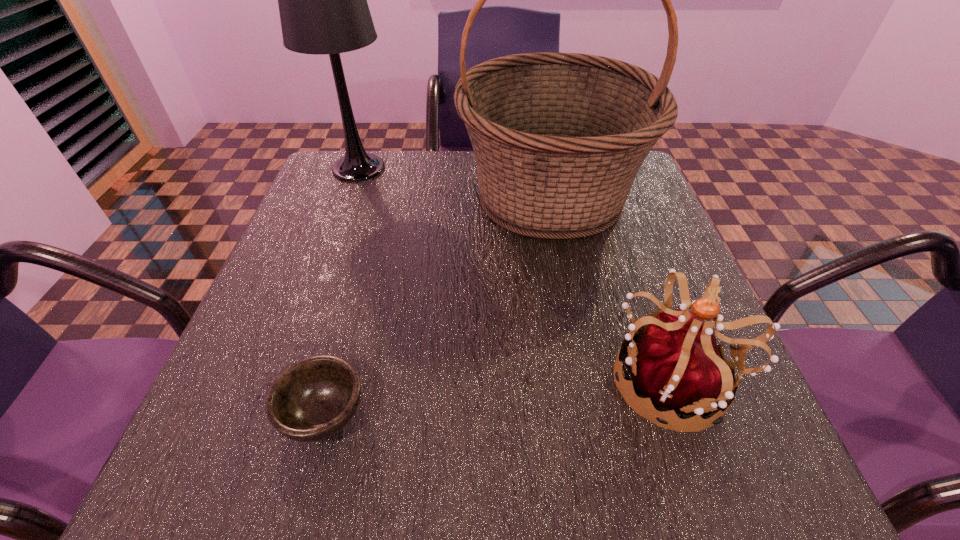
You are a GUI agent. You are given a task and a screenshot of the screen. Output one action in this format:
    pyautogui.click(x=<x>, y=<y>)
    Task: Click on the vacant point located between the table lamp and the second shortest object
    
    Given the screenshot: What is the action you would take?
    pyautogui.click(x=516, y=274)

The image size is (960, 540). Find the location of `empty space between the third tallest object and the basket`. empty space between the third tallest object and the basket is located at coordinates (612, 288).

Find the location of a particular element. free spot between the basket and the second shortest object is located at coordinates (612, 288).

What are the coordinates of `unoccupied area between the basket and the third tallest object` in the screenshot? It's located at (612, 288).

Identify the location of vacant area between the table lamp and the second shortest object. (516, 274).

Identify the location of empty space between the basket and the table lamp. The height and width of the screenshot is (540, 960). (454, 182).

Where is `unoccupied area between the basket and the bowl`? The width and height of the screenshot is (960, 540). unoccupied area between the basket and the bowl is located at coordinates (437, 305).

What are the coordinates of `vacant region between the basket and the table lamp` in the screenshot? It's located at (454, 182).

Where is `object that stands as the second closest to the basket`? The height and width of the screenshot is (540, 960). object that stands as the second closest to the basket is located at coordinates pos(677,364).

Where is `object that is the third closest to the tiara`? object that is the third closest to the tiara is located at coordinates (322, 0).